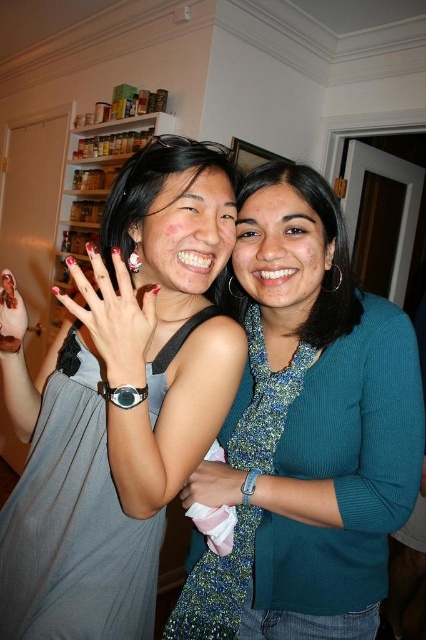
Does point (322, 566) come in front of point (233, 285)?

That is True.

This screenshot has width=426, height=640. Describe the element at coordinates (310, 426) in the screenshot. I see `teal ribbed sweater at center` at that location.

Image resolution: width=426 pixels, height=640 pixels. I want to click on teal ribbed sweater at center, so click(x=310, y=426).

Which is in front, point (342, 349) or point (249, 227)?

Point (342, 349)

Can you confirm if teal ribbed sweater at center is wider than smooth skin face at center?

Yes, teal ribbed sweater at center is wider than smooth skin face at center.

The width and height of the screenshot is (426, 640). What do you see at coordinates (310, 426) in the screenshot?
I see `teal ribbed sweater at center` at bounding box center [310, 426].

The image size is (426, 640). I want to click on teal ribbed sweater at center, so click(310, 426).

Does matte black face at center have a lesser height compared to blue textured sweater at center?

Correct, matte black face at center is not as tall as blue textured sweater at center.

Between point (204, 173) and point (238, 317), which one is positioned behind?

Positioned behind is point (238, 317).

Describe the element at coordinates (187, 230) in the screenshot. I see `matte black face at center` at that location.

The height and width of the screenshot is (640, 426). I want to click on matte black face at center, so (x=187, y=230).